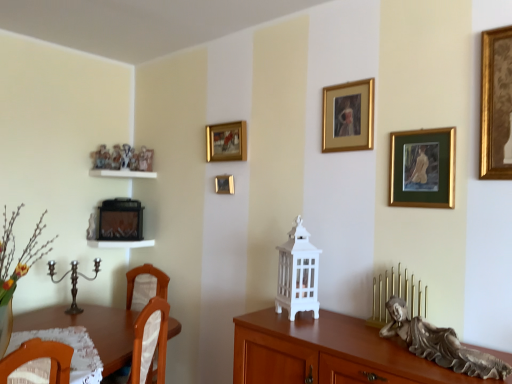
Question: Considering the relative sizes of white glossy shelf at center, arranged as the first shelf when ordered from the bottom, and white glossy shelf at upper left, which is the 2th shelf from bottom to top, in the image provided, is white glossy shelf at center, arranged as the first shelf when ordered from the bottom, bigger than white glossy shelf at upper left, which is the 2th shelf from bottom to top,?

Choices:
 (A) no
 (B) yes

Answer: (A)

Question: Can you confirm if white glossy shelf at center, arranged as the first shelf when ordered from the bottom, is taller than white glossy shelf at upper left, the first shelf in the top-to-bottom sequence?

Choices:
 (A) yes
 (B) no

Answer: (B)

Question: Can white glossy shelf at upper left, which is the 2th shelf from bottom to top, be found inside white glossy shelf at center, arranged as the first shelf when ordered from the bottom?

Choices:
 (A) yes
 (B) no

Answer: (B)

Question: From a real-world perspective, is white glossy shelf at center, arranged as the first shelf when ordered from the bottom, below white glossy shelf at upper left, the first shelf in the top-to-bottom sequence?

Choices:
 (A) yes
 (B) no

Answer: (A)

Question: Would you consider white glossy shelf at center, arranged as the first shelf when ordered from the bottom, to be distant from white glossy shelf at upper left, the first shelf in the top-to-bottom sequence?

Choices:
 (A) no
 (B) yes

Answer: (A)

Question: Is white glossy shelf at center, arranged as the first shelf when ordered from the bottom, spatially inside gold/glossy picture frame at upper center, arranged as the third picture frame when viewed from the right, or outside of it?

Choices:
 (A) inside
 (B) outside

Answer: (B)

Question: Is white glossy shelf at center, arranged as the first shelf when ordered from the bottom, taller or shorter than gold/glossy picture frame at upper center, arranged as the third picture frame when viewed from the right?

Choices:
 (A) tall
 (B) short

Answer: (B)

Question: Based on their positions, is white glossy shelf at center, arranged as the first shelf when ordered from the bottom, located to the left or right of gold/glossy picture frame at upper center, marked as the third picture frame in a front-to-back arrangement?

Choices:
 (A) right
 (B) left

Answer: (B)

Question: From the image's perspective, is white glossy shelf at center, arranged as the first shelf when ordered from the bottom, located above or below gold/glossy picture frame at upper center, marked as the third picture frame in a front-to-back arrangement?

Choices:
 (A) above
 (B) below

Answer: (B)

Question: Considering the positions of gold metallic candle holder at lower right, which is counted as the 2th candle holder, starting from the back, and brown wooden desk at lower left in the image, is gold metallic candle holder at lower right, which is counted as the 2th candle holder, starting from the back, bigger or smaller than brown wooden desk at lower left?

Choices:
 (A) big
 (B) small

Answer: (B)

Question: Is point (373, 278) positioned closer to the camera than point (121, 364)?

Choices:
 (A) closer
 (B) farther

Answer: (A)

Question: Relative to brown wooden desk at lower left, is gold metallic candle holder at lower right, which is counted as the 2th candle holder, starting from the back, in front or behind?

Choices:
 (A) front
 (B) behind

Answer: (A)

Question: In terms of height, does gold metallic candle holder at lower right, which appears as the 2th candle holder when viewed from the left, look taller or shorter compared to brown wooden desk at lower left?

Choices:
 (A) tall
 (B) short

Answer: (B)

Question: From the image's perspective, is white glossy shelf at center, which ranks as the second shelf in top-to-bottom order, located above or below polished silver candle holder at lower left, arranged as the first candle holder when viewed from the back?

Choices:
 (A) above
 (B) below

Answer: (A)

Question: Is white glossy shelf at center, arranged as the first shelf when ordered from the bottom, bigger or smaller than polished silver candle holder at lower left, the 2th candle holder in the front-to-back sequence?

Choices:
 (A) small
 (B) big

Answer: (A)